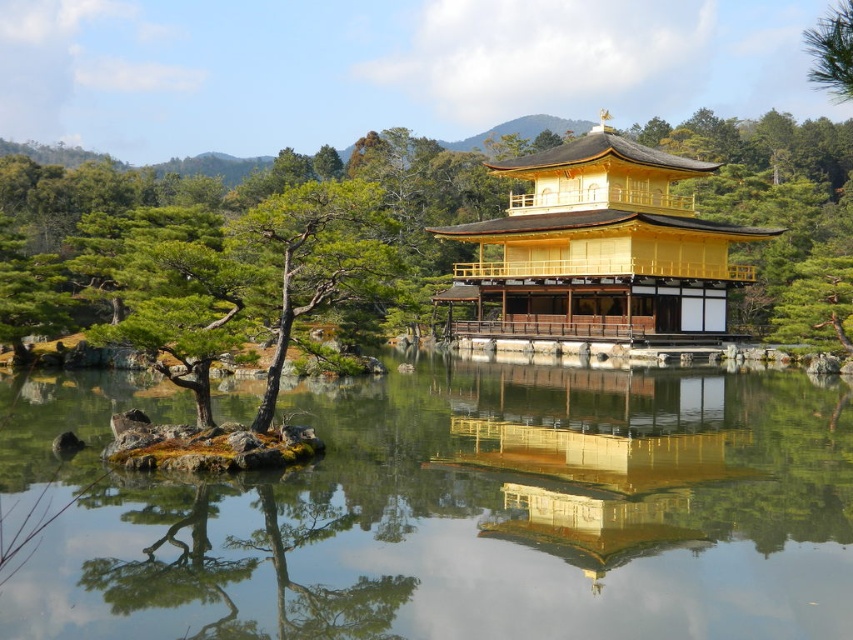
You are standing in front of the Kinkakuji pavilion and want to take a photo that includes both the transparent water at center and the green textured pine tree at upper right. Which object will appear larger in your photo?

The transparent water at center will appear larger in the photo because it is closer to the viewer than the green textured pine tree at upper right.

You are a tourist visiting the Kinkaku Temple and want to take a photo that includes both the golden polished wood palace at center and the green textured pine tree at upper right. Based on their heights, which object will appear larger in the photo?

The green textured pine tree at upper right will appear larger in the photo because it is taller than the golden polished wood palace at center.